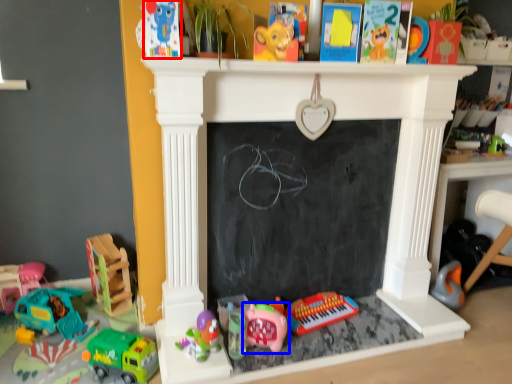
Question: Which object appears farthest to the camera in this image, toy (highlighted by a red box) or toy (highlighted by a blue box)?

Choices:
 (A) toy
 (B) toy

Answer: (B)